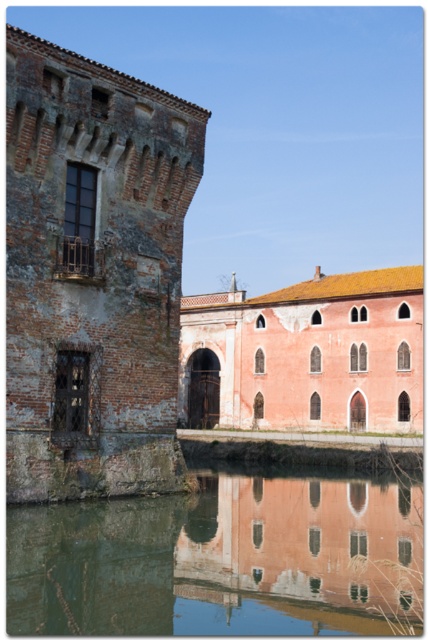
Consider the image. Between brick wall tower at left and greenish reflective water at lower center, which one is positioned higher?

Positioned higher is brick wall tower at left.

Between brick wall tower at left and greenish reflective water at lower center, which one appears on the left side from the viewer's perspective?

brick wall tower at left

Measure the distance between brick wall tower at left and camera.

brick wall tower at left is 26.32 meters away from camera.

Image resolution: width=428 pixels, height=640 pixels. Find the location of `brick wall tower at left`. brick wall tower at left is located at coordinates (92, 275).